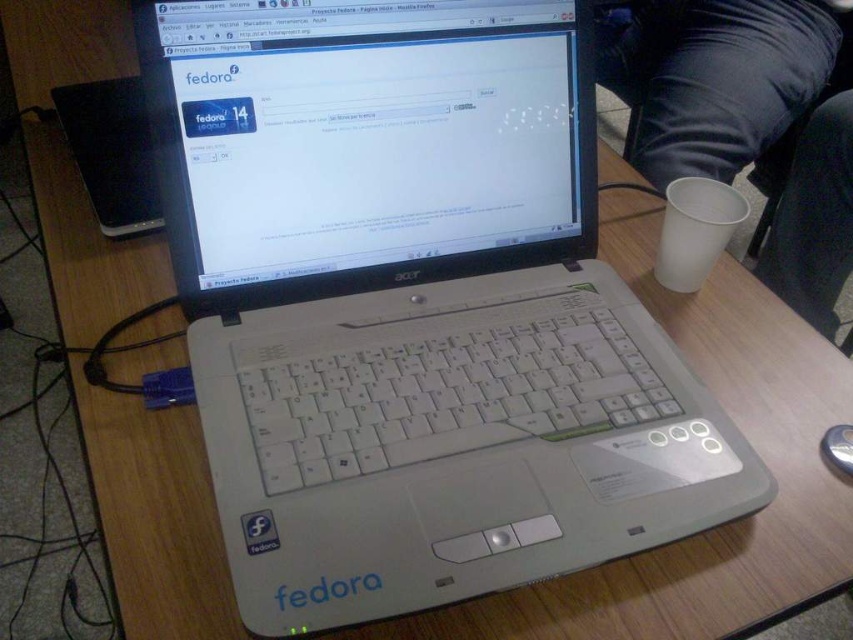
Question: Which point is closer to the camera?

Choices:
 (A) black fabric lap at upper right
 (B) silver metallic mouse at lower right

Answer: (B)

Question: Which object appears closest to the camera in this image?

Choices:
 (A) silver metallic mouse at lower right
 (B) black fabric lap at upper right

Answer: (A)

Question: Is black fabric lap at upper right wider than silver metallic mouse at lower right?

Choices:
 (A) no
 (B) yes

Answer: (B)

Question: Does black fabric lap at upper right have a smaller size compared to silver metallic mouse at lower right?

Choices:
 (A) no
 (B) yes

Answer: (A)

Question: Is black fabric lap at upper right bigger than silver metallic mouse at lower right?

Choices:
 (A) yes
 (B) no

Answer: (A)

Question: Which point appears closest to the camera in this image?

Choices:
 (A) (663, 17)
 (B) (834, 438)

Answer: (B)